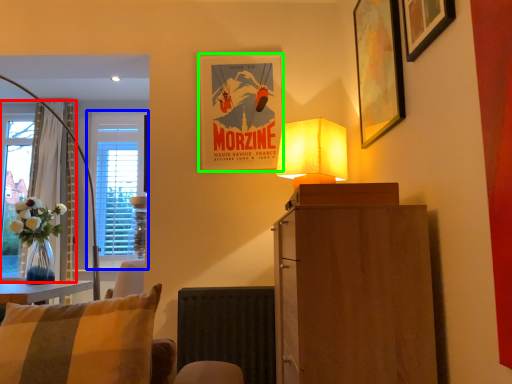
Question: Which object is the farthest from curtain (highlighted by a red box)? Choose among these: window (highlighted by a blue box) or picture frame (highlighted by a green box).

Choices:
 (A) window
 (B) picture frame

Answer: (B)